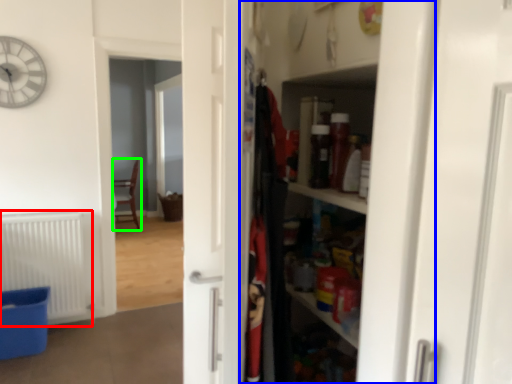
Question: Considering the real-world distances, which object is closest to radiator (highlighted by a red box)? dresser (highlighted by a blue box) or chair (highlighted by a green box).

Choices:
 (A) dresser
 (B) chair

Answer: (A)